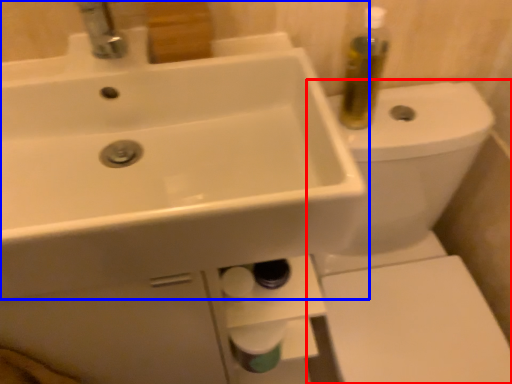
Question: Which object appears closest to the camera in this image, toilet (highlighted by a red box) or sink (highlighted by a blue box)?

Choices:
 (A) toilet
 (B) sink

Answer: (B)